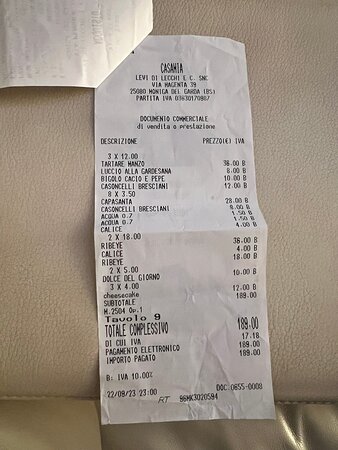
Where is `cushion`? The image size is (338, 450). cushion is located at coordinates (58, 303).